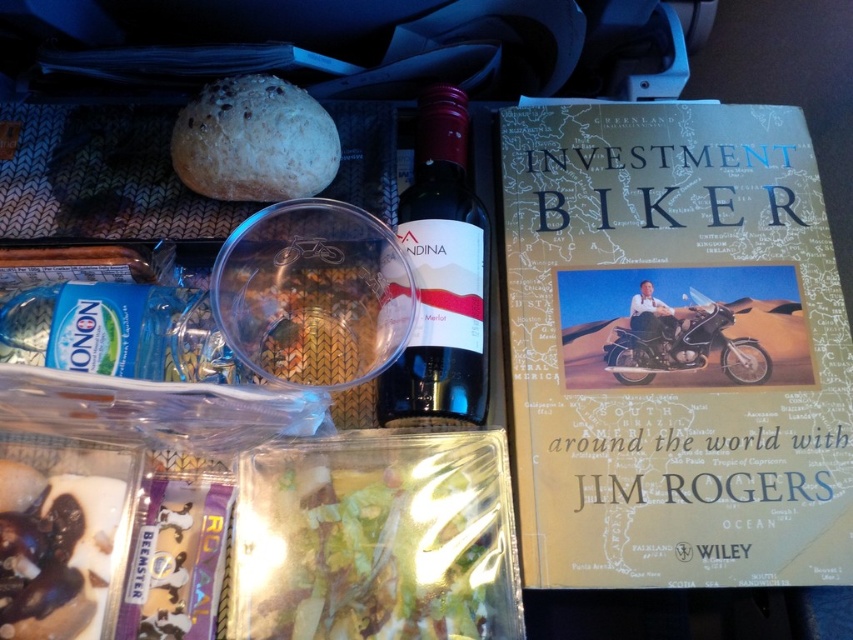
Question: From the image, what is the correct spatial relationship of translucent plastic salad at center in relation to matte glass wine bottle at center?

Choices:
 (A) right
 (B) left

Answer: (B)

Question: Does chocolate-coated nuts at lower left appear under brown crumbly bread at upper left?

Choices:
 (A) no
 (B) yes

Answer: (B)

Question: Among these objects, which one is nearest to the camera?

Choices:
 (A) hardcover book at right
 (B) matte glass wine bottle at center
 (C) metallic silver motorcycle at center

Answer: (A)

Question: Estimate the real-world distances between objects in this image. Which object is farther from the chocolate-coated nuts at lower left?

Choices:
 (A) metallic silver motorcycle at center
 (B) hardcover book at right

Answer: (A)

Question: Which object is the closest to the chocolate-coated nuts at lower left?

Choices:
 (A) brown crumbly bread at upper left
 (B) translucent plastic salad at center

Answer: (B)

Question: Is chocolate-coated nuts at lower left closer to camera compared to brown crumbly bread at upper left?

Choices:
 (A) no
 (B) yes

Answer: (B)